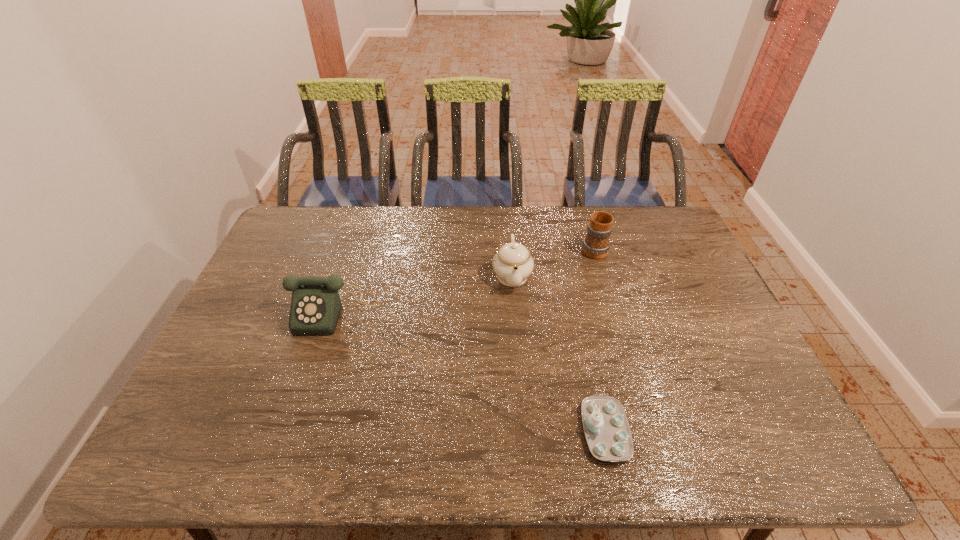
Locate an element on the screen. The height and width of the screenshot is (540, 960). mug is located at coordinates (596, 244).

Where is `the taller chinaware`? Image resolution: width=960 pixels, height=540 pixels. the taller chinaware is located at coordinates (513, 264).

This screenshot has height=540, width=960. I want to click on the second object from left to right, so click(513, 264).

This screenshot has width=960, height=540. Identify the location of the leftmost object. (315, 308).

Where is `the shortest object`? This screenshot has width=960, height=540. the shortest object is located at coordinates (606, 427).

What are the coordinates of `the nearest object` in the screenshot? It's located at (606, 427).

You are a GUI agent. You are given a task and a screenshot of the screen. Output one action in this format:
    pyautogui.click(x=<x>, y=<y>)
    Task: Click on the free spot located 0.170m on the side of the mug with the handle
    The image size is (960, 540).
    Given the screenshot: What is the action you would take?
    pyautogui.click(x=582, y=208)

Where is `blank space located 0.110m on the side of the mug with the handle`? Image resolution: width=960 pixels, height=540 pixels. blank space located 0.110m on the side of the mug with the handle is located at coordinates (585, 218).

You are a GUI agent. You are given a task and a screenshot of the screen. Output one action in this format:
    pyautogui.click(x=<x>, y=<y>)
    Task: Click on the vacant area located on the side of the mug with the handle
    
    Given the screenshot: What is the action you would take?
    pyautogui.click(x=584, y=213)

I want to click on blank area located 0.370m at the spout of the taller chinaware, so click(522, 407).